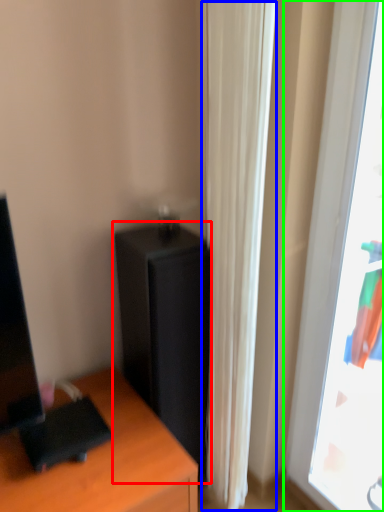
Question: Considering the real-world distances, which object is closest to file cabinet (highlighted by a red box)? curtain (highlighted by a blue box) or window (highlighted by a green box).

Choices:
 (A) curtain
 (B) window

Answer: (A)